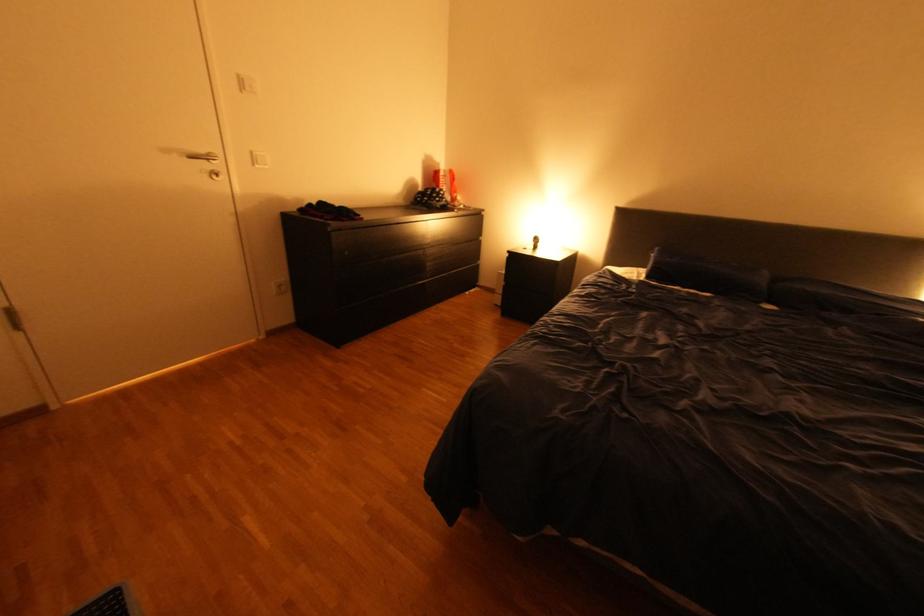
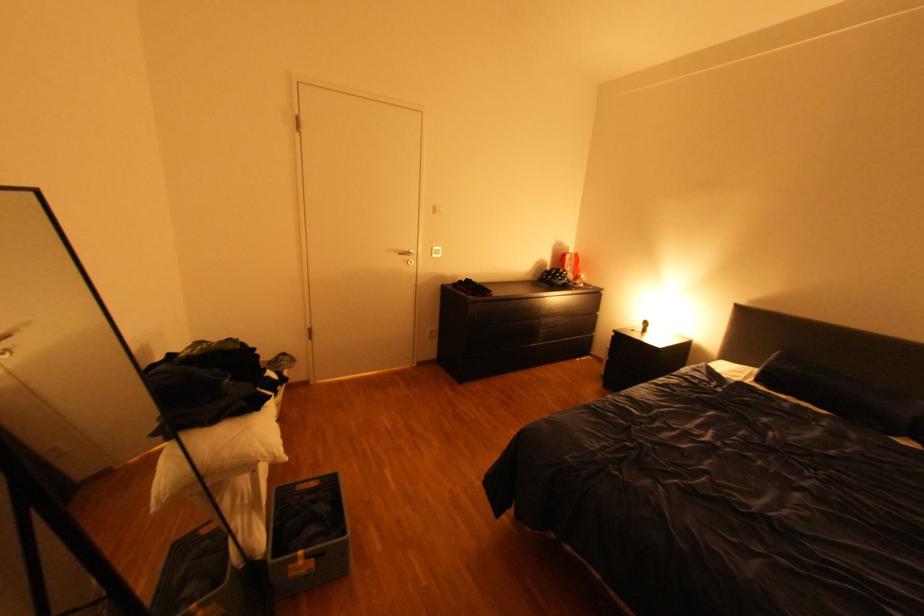
In the second image, find the point that corresponds to point (433, 236) in the first image.

(550, 309)